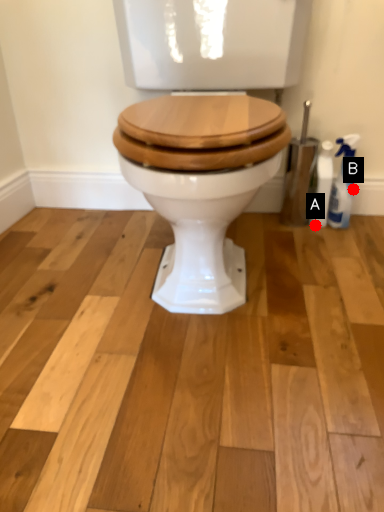
Question: Two points are circled on the image, labeled by A and B beside each circle. Which point is further to the camera?

Choices:
 (A) A is further
 (B) B is further

Answer: (A)